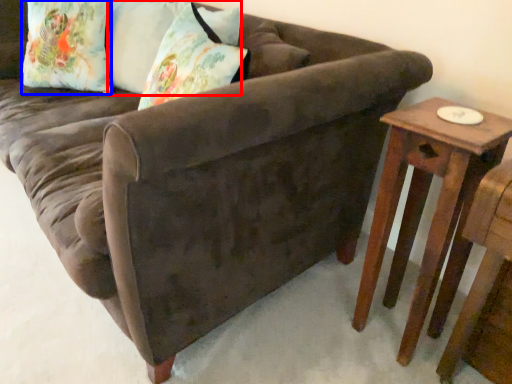
Question: Which point is closer to the camera, pillow (highlighted by a red box) or pillow (highlighted by a blue box)?

Choices:
 (A) pillow
 (B) pillow

Answer: (A)